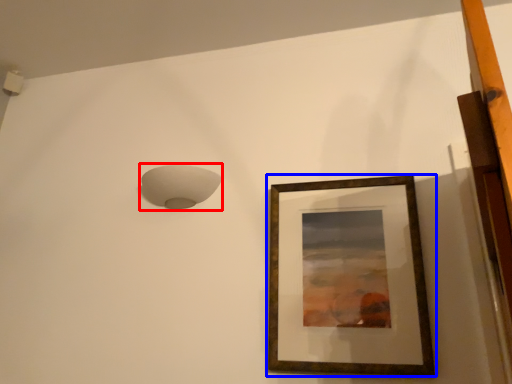
Question: Which point is closer to the camera, lamp (highlighted by a red box) or picture frame (highlighted by a blue box)?

Choices:
 (A) lamp
 (B) picture frame

Answer: (B)